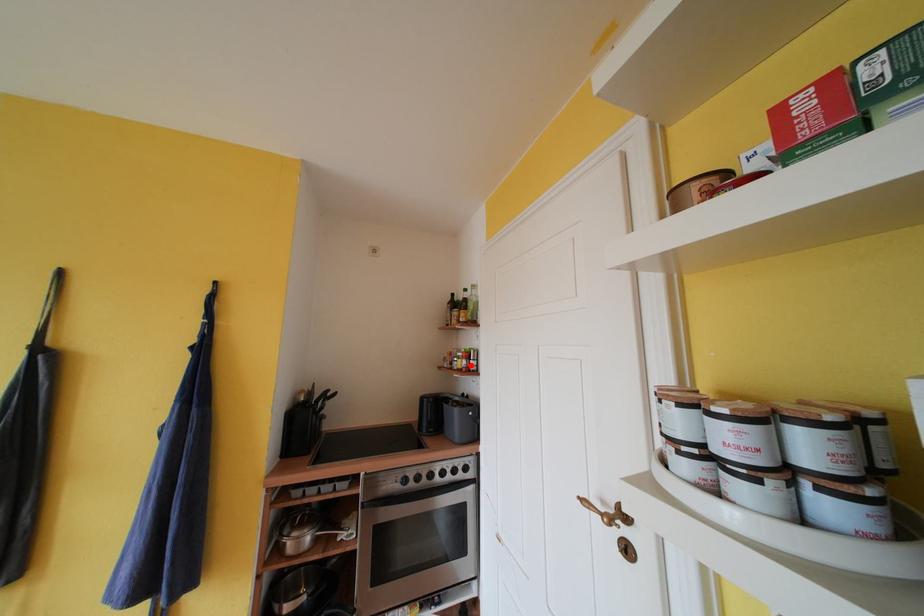
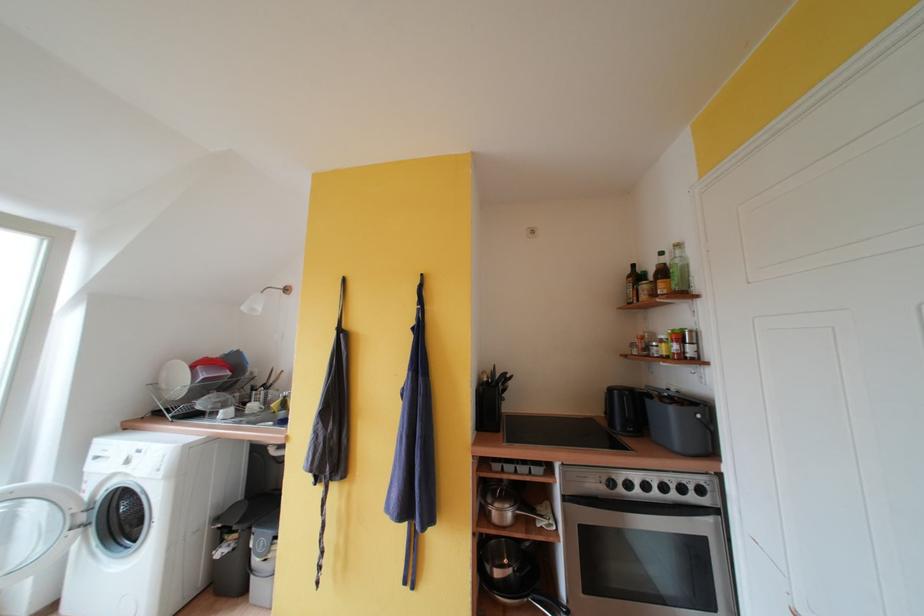
Where in the second image is the point corresponding to the highlighted location from the first image?

(682, 350)